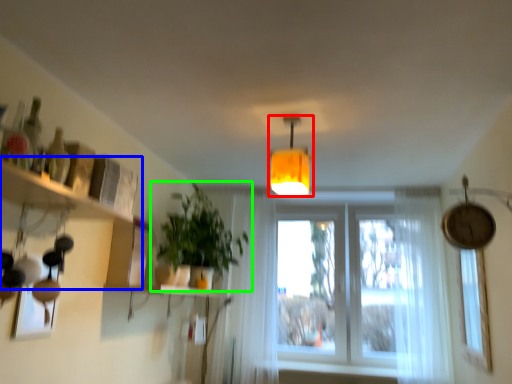
Question: Considering the real-world distances, which object is farthest from lamp (highlighted by a red box)? shelf (highlighted by a blue box) or houseplant (highlighted by a green box)?

Choices:
 (A) shelf
 (B) houseplant

Answer: (A)